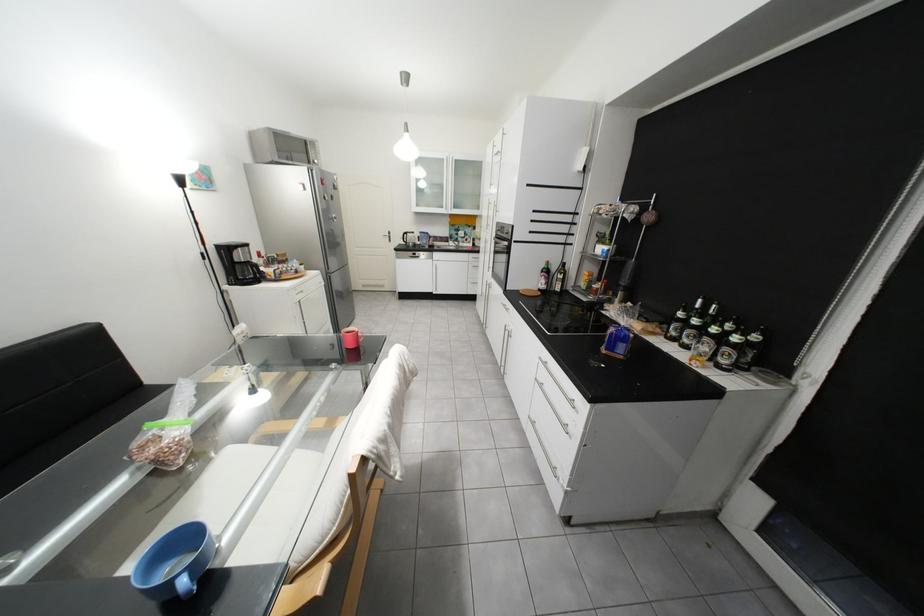
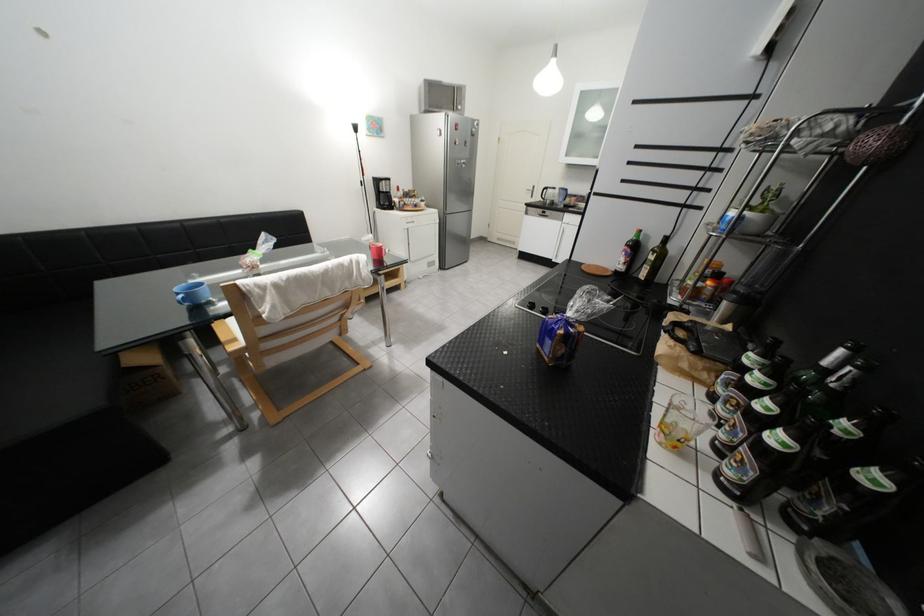
In the second image, find the point that corresponds to the point at 195,582 in the first image.

(192, 297)